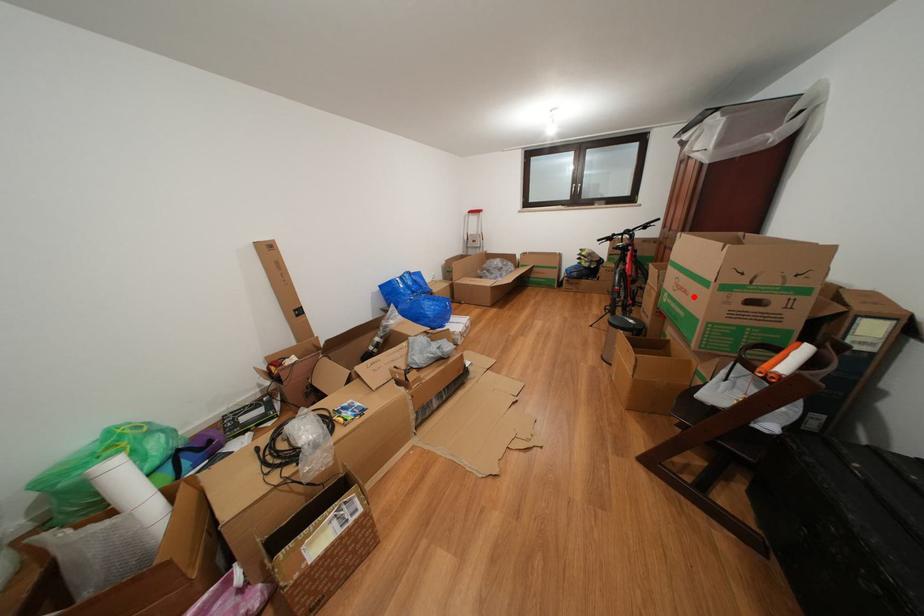
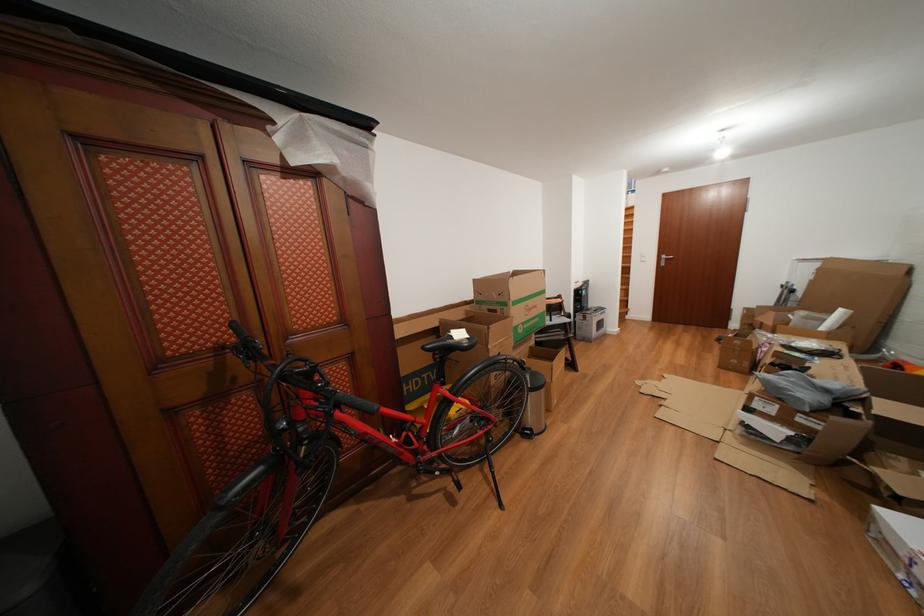
Where in the second image is the point corresponding to the highlighted location from the first image?

(543, 312)